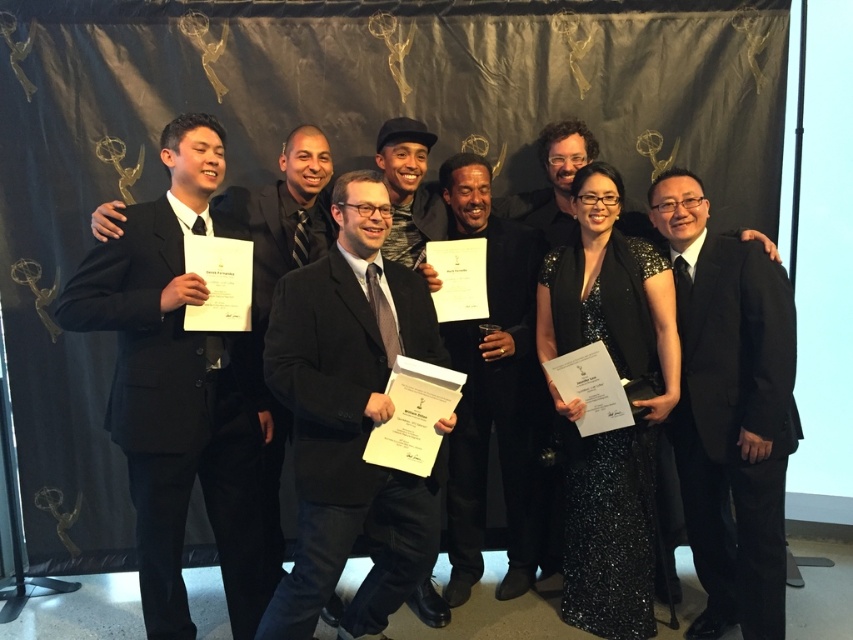
Question: Does black shiny suit at right have a lesser width compared to black sequined dress at center?

Choices:
 (A) yes
 (B) no

Answer: (A)

Question: Estimate the real-world distances between objects in this image. Which object is closer to the matte black suit at center?

Choices:
 (A) black velvet suit at center
 (B) black sequined dress at center

Answer: (A)

Question: Is black shiny suit at right positioned at the back of black matte suit at left?

Choices:
 (A) no
 (B) yes

Answer: (A)

Question: Estimate the real-world distances between objects in this image. Which object is farther from the black velvet suit at center?

Choices:
 (A) black sequined dress at center
 (B) black matte suit at left

Answer: (B)

Question: From the image, what is the correct spatial relationship of black sequined dress at center in relation to black velvet suit at center?

Choices:
 (A) above
 (B) below

Answer: (B)

Question: Which object is positioned closest to the black velvet suit at center?

Choices:
 (A) black matte suit at left
 (B) black sequined dress at center
 (C) matte black suit at center
 (D) black shiny suit at right

Answer: (B)